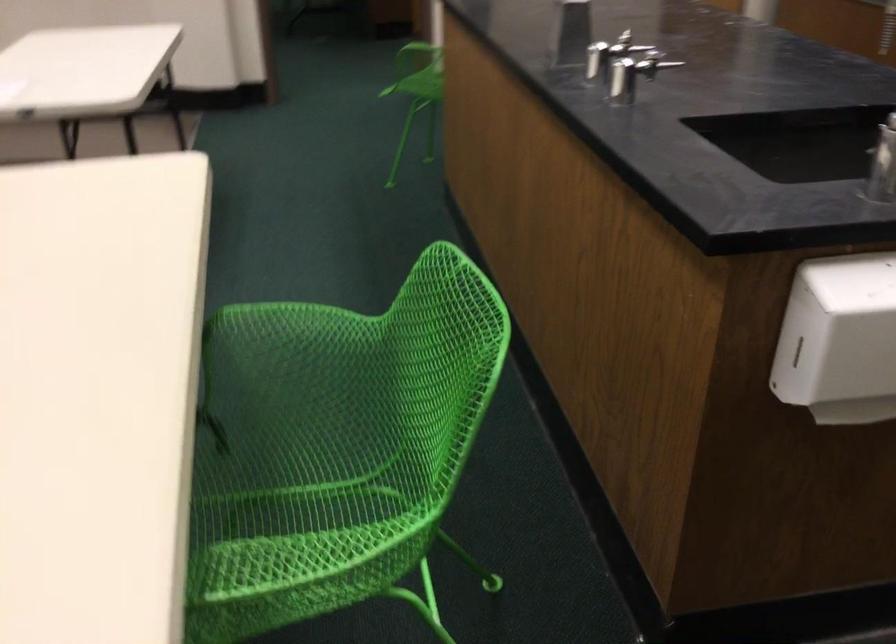
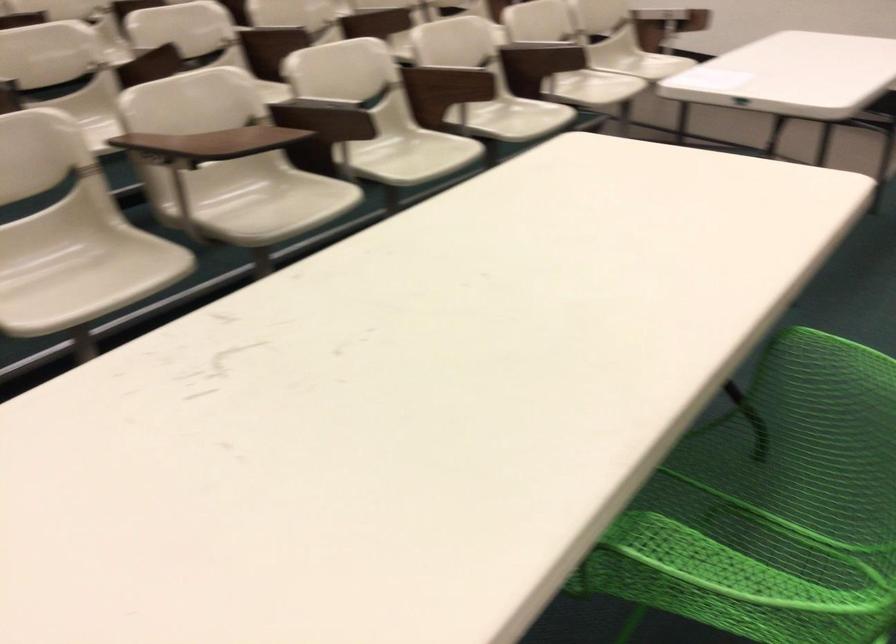
Where in the second image is the point corresponding to point (286, 506) from the first image?

(760, 527)